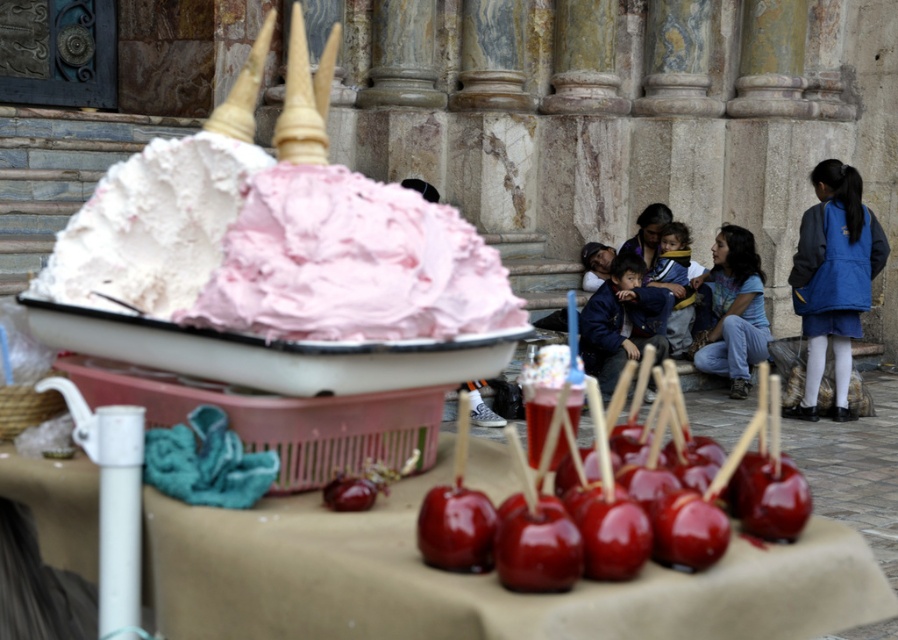
Which is more to the right, white fluffy frosting at center or glossy red apple at lower center?

Positioned to the right is glossy red apple at lower center.

Consider the image. Can you confirm if white fluffy frosting at center is bigger than glossy red apple at lower center?

Yes.

Is point (75, 282) behind point (486, 522)?

Yes, it is.

Where is `white fluffy frosting at center`? The image size is (898, 640). white fluffy frosting at center is located at coordinates (151, 227).

Does pink fluffy frosting at center have a greater width compared to blue denim jeans at lower right?

No.

Is pink fluffy frosting at center closer to camera compared to blue denim jeans at lower right?

Yes, pink fluffy frosting at center is closer to the viewer.

Is point (412, 230) closer to viewer compared to point (725, 355)?

Yes, point (412, 230) is in front of point (725, 355).

Where is `pink fluffy frosting at center`? pink fluffy frosting at center is located at coordinates (350, 262).

Does pink fluffy frosting at center lie behind blue fleece jacket at right?

No, pink fluffy frosting at center is closer to the viewer.

Can you confirm if pink fluffy frosting at center is shorter than blue fleece jacket at right?

Correct, pink fluffy frosting at center is not as tall as blue fleece jacket at right.

Identify the location of pink fluffy frosting at center. The height and width of the screenshot is (640, 898). (350, 262).